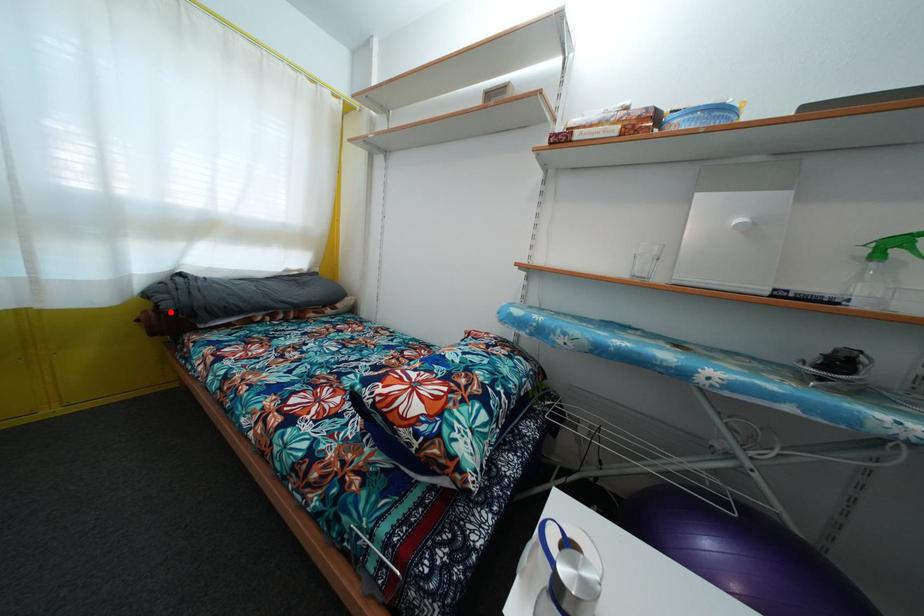
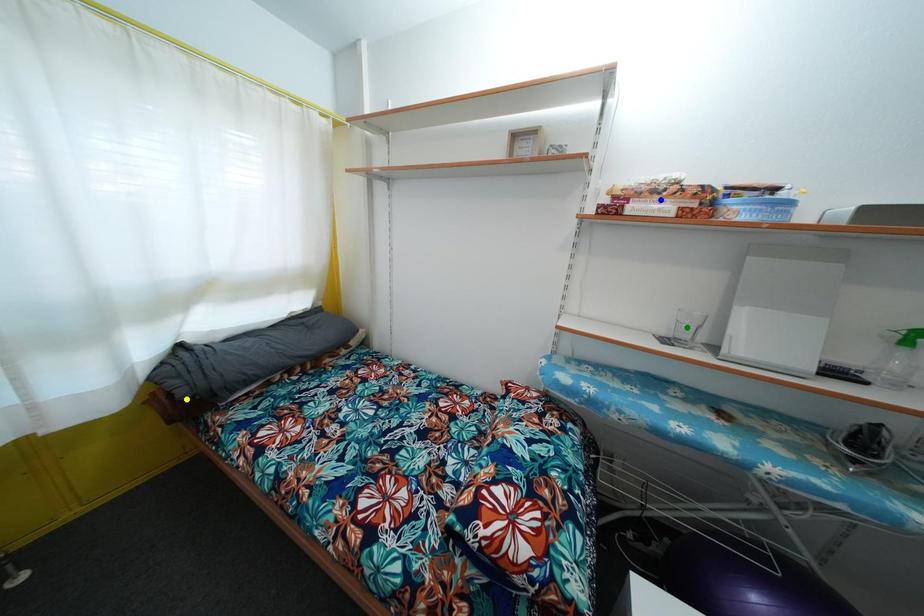
Question: I am providing you with two images of the same scene from different viewpoints. A red point is marked on the first image. You are given multiple points on the second image. In image 2, which mark is for the same physical point as the one in image 1?

Choices:
 (A) yellow point
 (B) green point
 (C) blue point

Answer: (A)